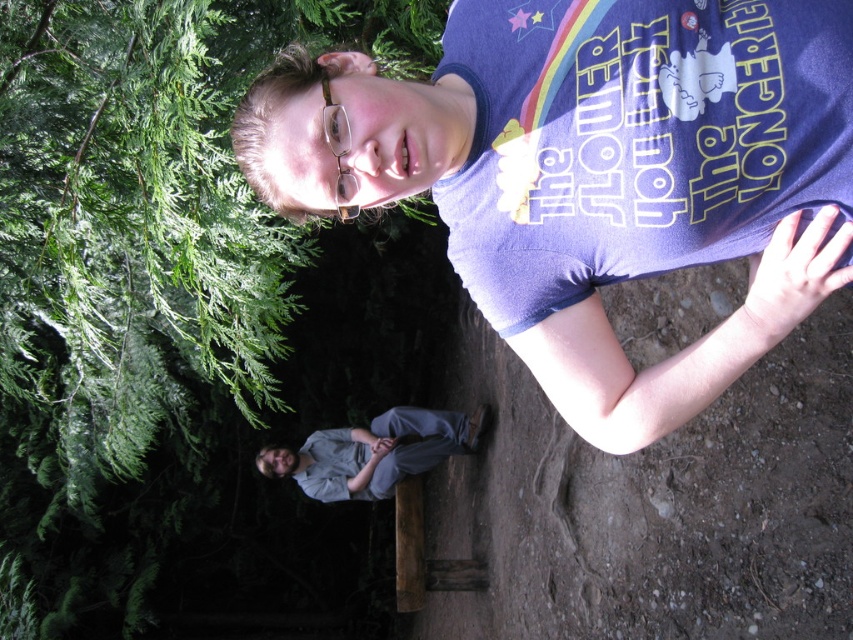
Question: Which object is closer to the camera taking this photo?

Choices:
 (A) purple cotton t-shirt at upper center
 (B) green leafy tree at upper left
 (C) gray cotton pants at lower center
 (D) clear plastic glasses at upper center

Answer: (D)

Question: Which is nearer to the clear plastic glasses at upper center?

Choices:
 (A) green leafy tree at upper left
 (B) purple cotton t-shirt at upper center

Answer: (B)

Question: Is purple cotton t-shirt at upper center above clear plastic glasses at upper center?

Choices:
 (A) no
 (B) yes

Answer: (A)

Question: Which object is positioned farthest from the clear plastic glasses at upper center?

Choices:
 (A) gray cotton pants at lower center
 (B) purple cotton t-shirt at upper center

Answer: (A)

Question: Is gray cotton pants at lower center smaller than clear plastic glasses at upper center?

Choices:
 (A) no
 (B) yes

Answer: (A)

Question: Does green leafy tree at upper left appear under purple cotton t-shirt at upper center?

Choices:
 (A) yes
 (B) no

Answer: (B)